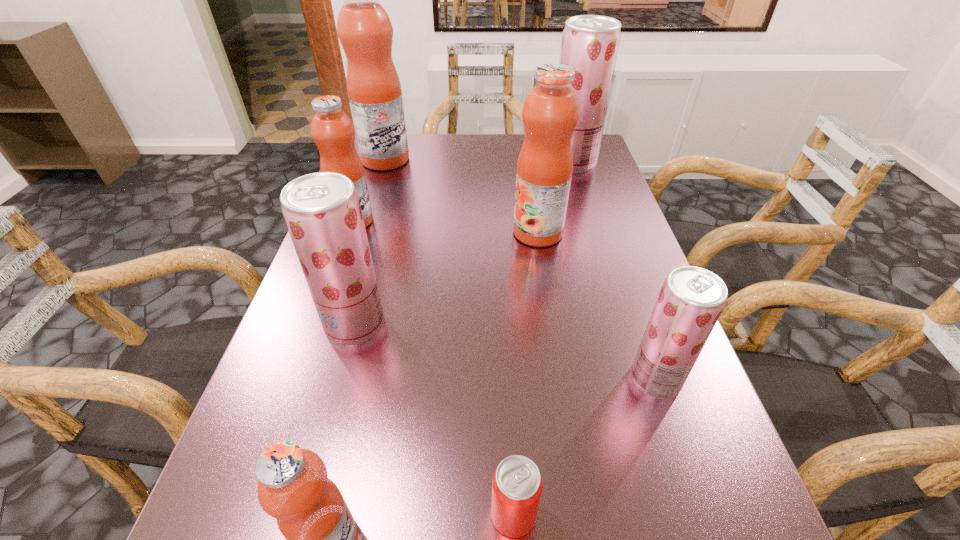
Find the location of a particular element. This screenshot has height=540, width=960. vacant space that satisfies the following two spatial constraints: 1. on the front label of the third biggest orange fruit juice; 2. on the left side of the third nearest fruit juice is located at coordinates (318, 325).

Find the location of a particular element. The width and height of the screenshot is (960, 540). free location that satisfies the following two spatial constraints: 1. on the front label of the third biggest orange fruit juice; 2. on the back side of the red can is located at coordinates (251, 514).